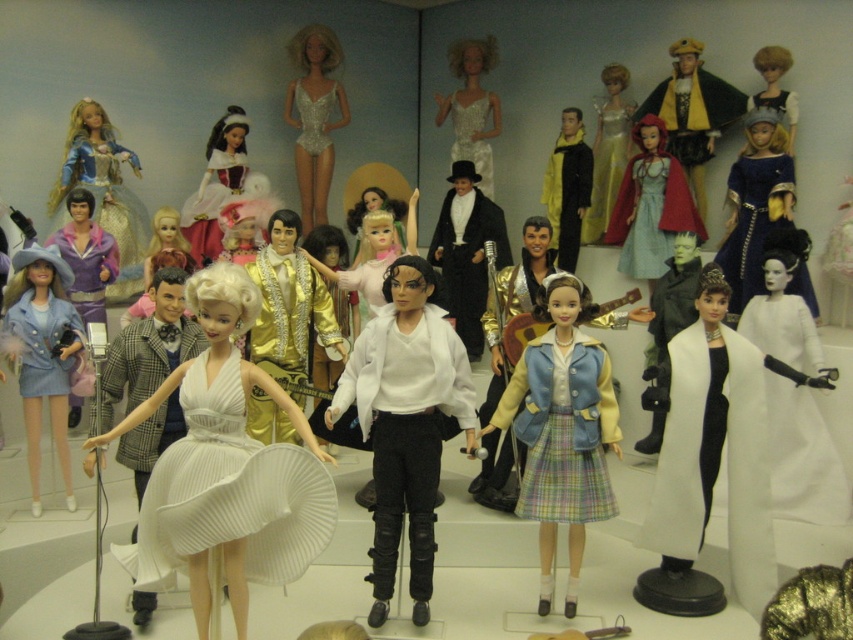
Does white satin dress at right appear over matte red dress at center?

No, white satin dress at right is not above matte red dress at center.

Is white satin dress at right behind matte red dress at center?

No, white satin dress at right is in front of matte red dress at center.

Is point (790, 410) positioned before point (601, 131)?

Yes, point (790, 410) is closer to viewer.

You are a GUI agent. You are given a task and a screenshot of the screen. Output one action in this format:
    pyautogui.click(x=<x>, y=<y>)
    Task: Click on the white satin dress at right
    The width and height of the screenshot is (853, 640).
    Given the screenshot: What is the action you would take?
    pyautogui.click(x=802, y=458)

Is point (316, 177) positioned in front of point (618, 172)?

No.

At what (x,y) coordinates should I click in order to perform the action: click on shiny silver bodysuit at center. Please return your answer as a coordinate pair (x, y). The height and width of the screenshot is (640, 853). Looking at the image, I should click on (314, 116).

The width and height of the screenshot is (853, 640). I want to click on shiny silver bodysuit at center, so click(314, 116).

How distant is velvet gold cape at upper right from shiny silver dress at upper right?

The distance of velvet gold cape at upper right from shiny silver dress at upper right is 16.66 inches.

Who is shorter, velvet gold cape at upper right or shiny silver dress at upper right?

With less height is shiny silver dress at upper right.

Who is more distant from viewer, (699, 124) or (775, 80)?

The point (699, 124) is behind.

The image size is (853, 640). In order to click on velvet gold cape at upper right in this screenshot , I will do `click(692, 113)`.